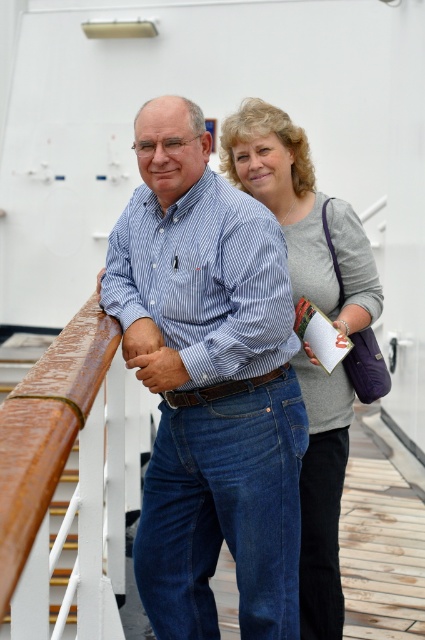
Which is above, gray matte sweater at center or rusty wood handrail at left?

gray matte sweater at center

Does gray matte sweater at center appear on the left side of rusty wood handrail at left?

In fact, gray matte sweater at center is to the right of rusty wood handrail at left.

The image size is (425, 640). I want to click on gray matte sweater at center, so click(303, 214).

In order to click on gray matte sweater at center in this screenshot , I will do `click(303, 214)`.

Does blue striped shirt at center appear on the right side of rusty wood handrail at left?

Correct, you'll find blue striped shirt at center to the right of rusty wood handrail at left.

Can you confirm if blue striped shirt at center is taller than rusty wood handrail at left?

Yes.

Locate an element on the screen. This screenshot has height=640, width=425. blue striped shirt at center is located at coordinates point(209,384).

Is point (192, 580) closer to camera compared to point (380, 301)?

That is True.

Can you confirm if blue striped shirt at center is positioned below gray matte sweater at center?

Yes, blue striped shirt at center is below gray matte sweater at center.

Who is more forward, (x=146, y=168) or (x=359, y=246)?

Point (x=146, y=168)

Locate an element on the screen. blue striped shirt at center is located at coordinates (209, 384).